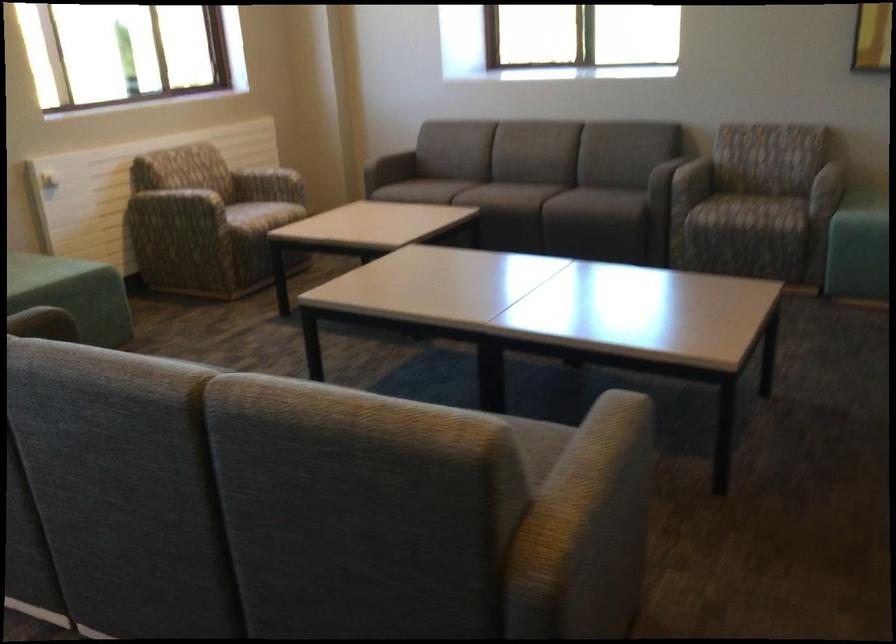
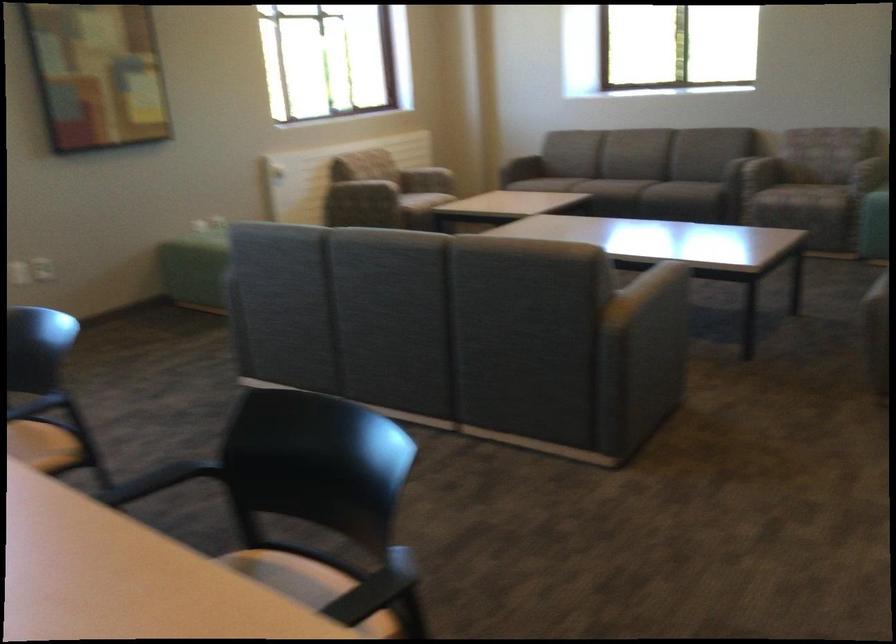
Question: I am providing you with two images of the same scene from different viewpoints. Which of the following objects are not visible in image2?

Choices:
 (A) sofa sitting surface
 (B) striped blanket
 (C) sofa armrest
 (D) chair armrest

Answer: (A)